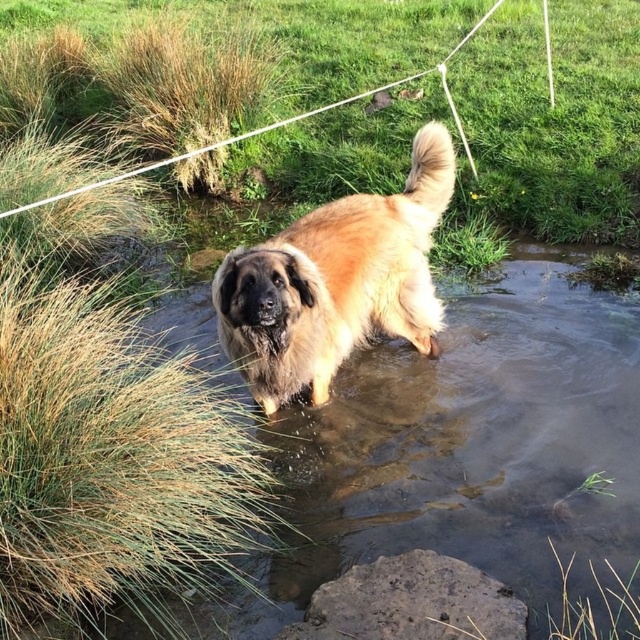
You are standing at the origin point of the image. You want to walk to the point labeled as point (624,164). However, there is an obstacle at point (257,396). Will you encounter this obstacle before reaching your destination?

Yes, you will encounter the obstacle at point (257,396) before reaching point (624,164) because point (624,164) is behind point (257,396).

You are a photographer trying to capture the entire scene of the green grass at upper center and the fuzzy brown dog at center in one shot. Based on their sizes in the image, which object would you need to focus on more to ensure both are clearly visible?

The fuzzy brown dog at center occupies more space than the green grass at upper center, so you should focus on the fuzzy brown dog at center to ensure both are clearly visible.

You are a photographer trying to capture the fuzzy brown dog at center and the green grass at upper center in a single shot. Based on their positions, which object is located to the right of the other?

The green grass at upper center is positioned on the right side of the fuzzy brown dog at center, so the green grass at upper center is to the right of the fuzzy brown dog at center.